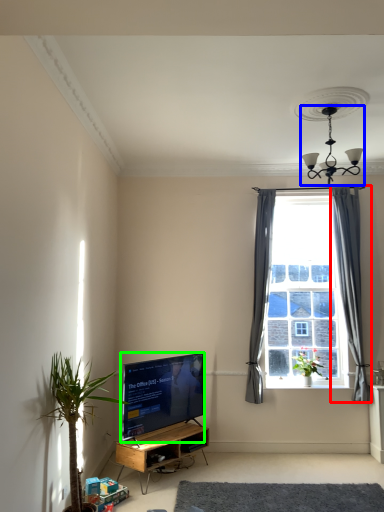
Question: Which is farther away from curtain (highlighted by a red box)? light fixture (highlighted by a blue box) or television (highlighted by a green box)?

Choices:
 (A) light fixture
 (B) television

Answer: (B)